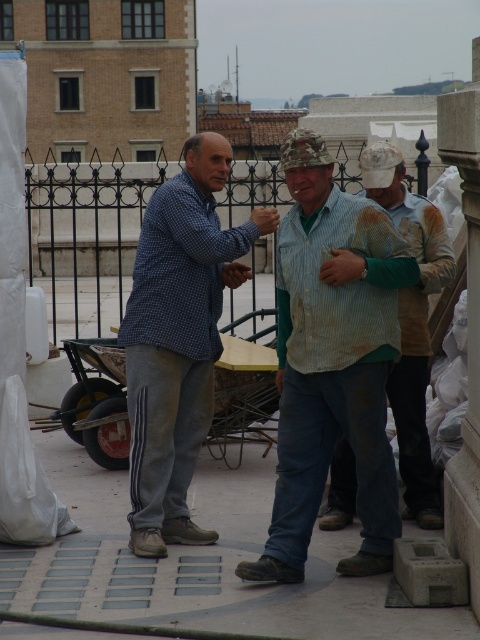
Consider the image. Does striped cotton shirt at center have a lesser width compared to rusty metal shirt at center?

Indeed, striped cotton shirt at center has a lesser width compared to rusty metal shirt at center.

Where is `striped cotton shirt at center`? striped cotton shirt at center is located at coordinates (332, 362).

Where is `striped cotton shirt at center`? The image size is (480, 640). striped cotton shirt at center is located at coordinates (332, 362).

Between blue checkered shirt at center and rusty metal shirt at center, which one appears on the left side from the viewer's perspective?

Positioned to the left is blue checkered shirt at center.

Which is behind, point (152, 198) or point (411, 374)?

Point (411, 374)

The height and width of the screenshot is (640, 480). I want to click on blue checkered shirt at center, so click(179, 339).

The image size is (480, 640). What do you see at coordinates (332, 362) in the screenshot?
I see `striped cotton shirt at center` at bounding box center [332, 362].

Which is behind, point (369, 241) or point (137, 440)?

Positioned behind is point (137, 440).

At what (x,y) coordinates should I click in order to perform the action: click on striped cotton shirt at center. Please return your answer as a coordinate pair (x, y). The image size is (480, 640). Looking at the image, I should click on (332, 362).